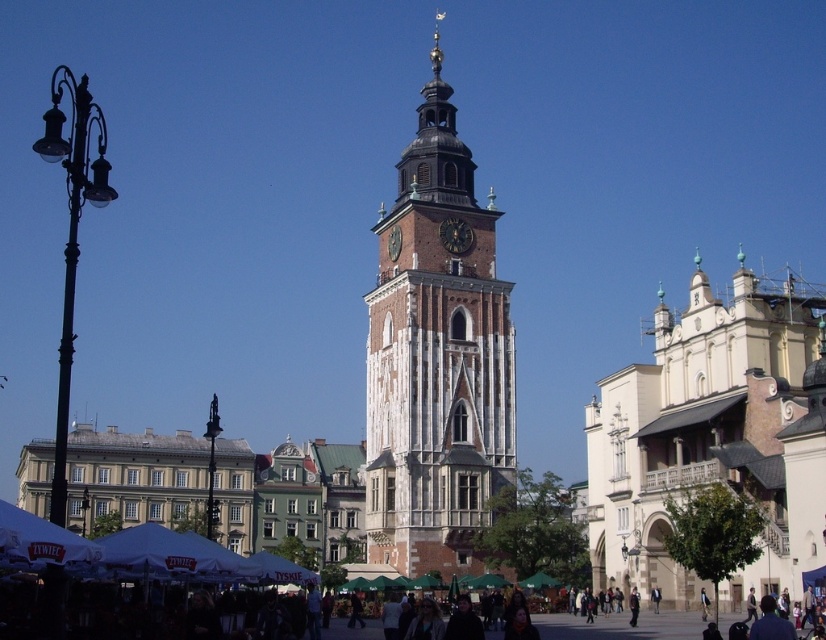
Measure the distance between stone clock tower at center and white stone church at right.

stone clock tower at center is 20.89 meters from white stone church at right.

Does stone clock tower at center appear under white stone church at right?

Incorrect, stone clock tower at center is not positioned below white stone church at right.

Which is in front, point (447, 540) or point (590, 413)?

Point (590, 413) is in front.

At what (x,y) coordinates should I click in order to perform the action: click on stone clock tower at center. Please return your answer as a coordinate pair (x, y). This screenshot has height=640, width=826. Looking at the image, I should click on (435, 358).

Does point (444, 548) come in front of point (454, 225)?

Yes, it is.

Does point (438, 252) come farther from viewer compared to point (472, 236)?

No, (438, 252) is closer to viewer.

Does point (390, 276) lie in front of point (451, 221)?

That is False.

You are a GUI agent. You are given a task and a screenshot of the screen. Output one action in this format:
    pyautogui.click(x=<x>, y=<y>)
    Task: Click on the stone clock tower at center
    This screenshot has height=640, width=826.
    Given the screenshot: What is the action you would take?
    pyautogui.click(x=435, y=358)

Is white stone church at right taller than dark brown stone clock at center?

Yes.

Who is more distant from viewer, (810, 300) or (468, 237)?

Point (468, 237)

Identify the location of white stone church at right. The height and width of the screenshot is (640, 826). (703, 429).